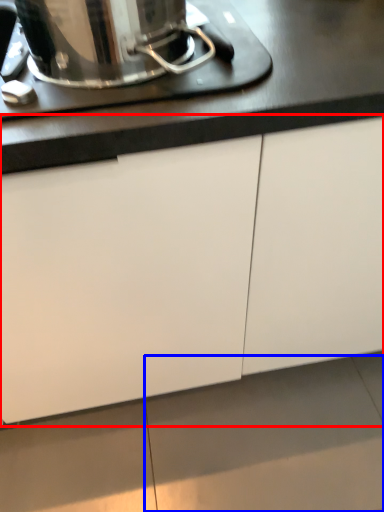
Question: Among these objects, which one is nearest to the camera, cabinetry (highlighted by a red box) or tile (highlighted by a blue box)?

Choices:
 (A) cabinetry
 (B) tile

Answer: (A)